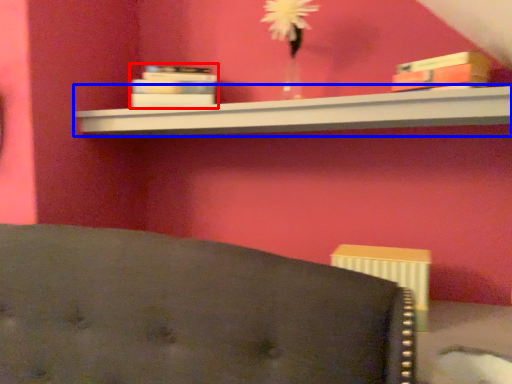
Question: Among these objects, which one is farthest to the camera, book (highlighted by a red box) or shelf (highlighted by a blue box)?

Choices:
 (A) book
 (B) shelf

Answer: (A)